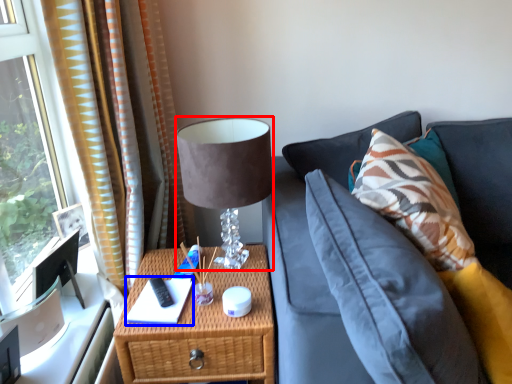
Question: Which object appears farthest to the camera in this image, table lamp (highlighted by a red box) or book (highlighted by a blue box)?

Choices:
 (A) table lamp
 (B) book

Answer: (B)